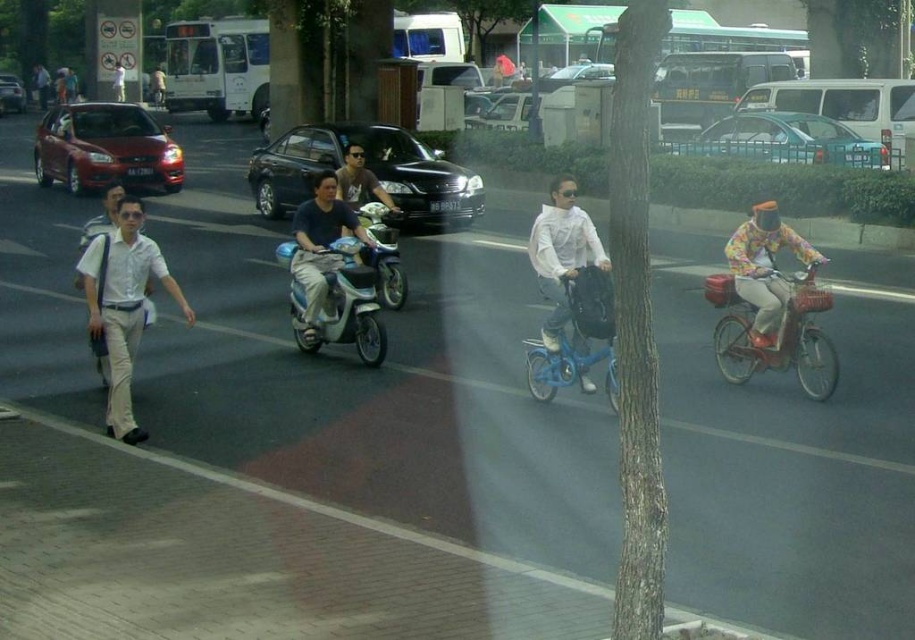
You are a delivery person needing to pass through the street. You see a white matte bicycle at center and a metallic silver scooter at center. Which object is closer to the right edge of the street?

The white matte bicycle at center is positioned on the right side of the metallic silver scooter at center, so it is closer to the right edge of the street.